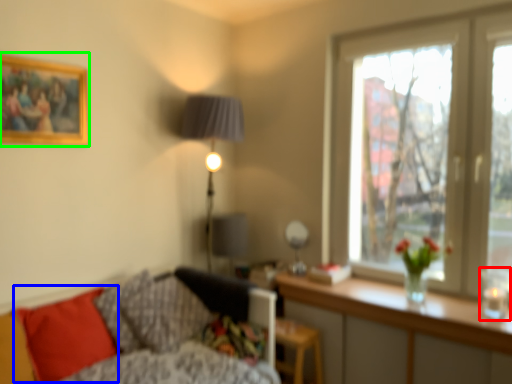
Question: Which is farther away from candle holder (highlighted by a red box)? pillow (highlighted by a blue box) or picture frame (highlighted by a green box)?

Choices:
 (A) pillow
 (B) picture frame

Answer: (B)